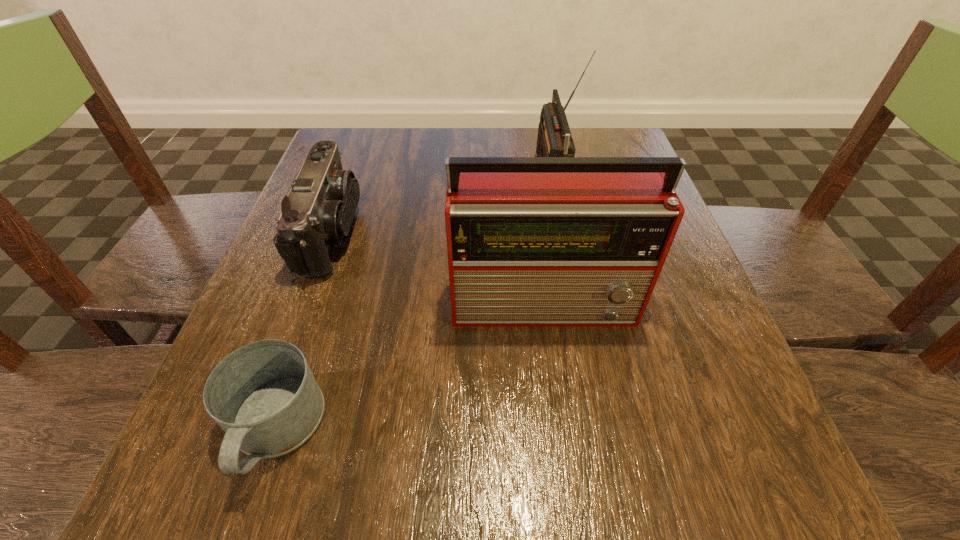
Locate an element on the screen. The width and height of the screenshot is (960, 540). vacant space that's between the camcorder and the nearer radio receiver is located at coordinates (440, 268).

What are the coordinates of `object that stands as the third closest to the nearer radio receiver` in the screenshot? It's located at (554, 139).

The height and width of the screenshot is (540, 960). I want to click on object that is the closest to the mug, so click(318, 212).

You are a GUI agent. You are given a task and a screenshot of the screen. Output one action in this format:
    pyautogui.click(x=<x>, y=<y>)
    Task: Click on the vacant position in the image that satisfies the following two spatial constraints: 1. on the front-facing side of the farther radio receiver; 2. on the front-facing side of the nearer radio receiver
    
    Given the screenshot: What is the action you would take?
    pyautogui.click(x=578, y=303)

Locate an element on the screen. Image resolution: width=960 pixels, height=540 pixels. vacant space that satisfies the following two spatial constraints: 1. on the front-facing side of the farther radio receiver; 2. on the side of the shortest object with the handle is located at coordinates (604, 430).

Image resolution: width=960 pixels, height=540 pixels. I want to click on free space that satisfies the following two spatial constraints: 1. on the front-facing side of the farther radio receiver; 2. on the side of the mug with the handle, so click(x=604, y=430).